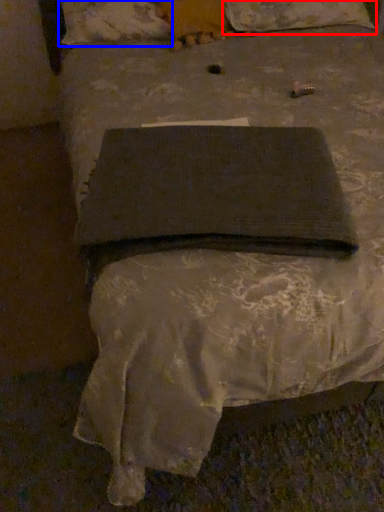
Question: Which object appears closest to the camera in this image, pillow (highlighted by a red box) or pillow (highlighted by a blue box)?

Choices:
 (A) pillow
 (B) pillow

Answer: (B)